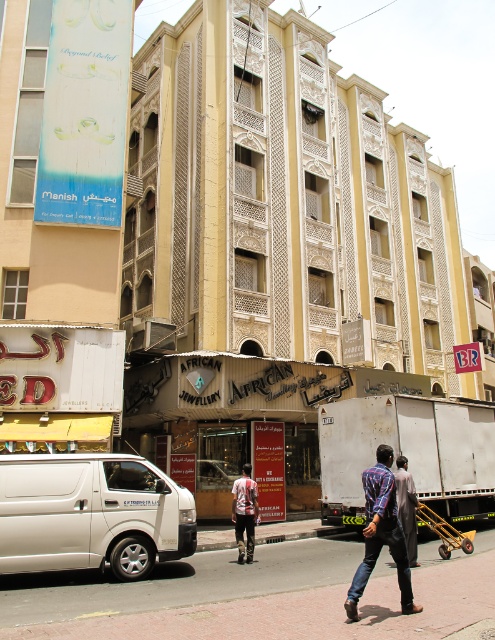
Question: Can you confirm if blue plaid shirt at center is bigger than reddish-brown leather pants at center?

Choices:
 (A) no
 (B) yes

Answer: (B)

Question: Is white matte van at lower left wider than reddish-brown leather pants at center?

Choices:
 (A) yes
 (B) no

Answer: (A)

Question: Which point is farther to the camera?

Choices:
 (A) pos(401,522)
 (B) pos(169,620)
 (C) pos(55,515)
 (D) pos(390,500)

Answer: (A)

Question: Which point appears farthest from the camera in this image?

Choices:
 (A) (302, 573)
 (B) (245, 529)
 (C) (407, 522)

Answer: (B)

Question: Estimate the real-world distances between objects in this image. Which object is closer to the white matte van at lower left?

Choices:
 (A) dark brown leather jacket at center
 (B) paved concrete sidewalk at lower center

Answer: (B)

Question: Does white matte van at lower left have a lesser width compared to dark brown leather jacket at center?

Choices:
 (A) yes
 (B) no

Answer: (B)